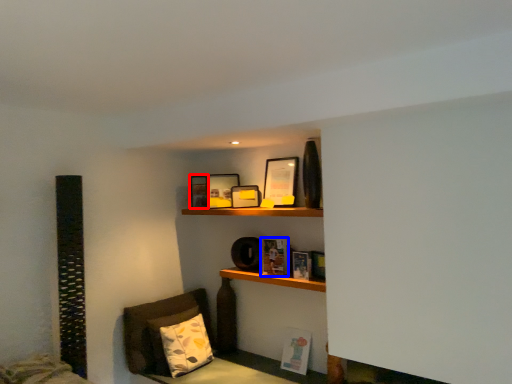
Question: Which object is closer to the camera taking this photo, picture frame (highlighted by a red box) or book (highlighted by a blue box)?

Choices:
 (A) picture frame
 (B) book

Answer: (B)